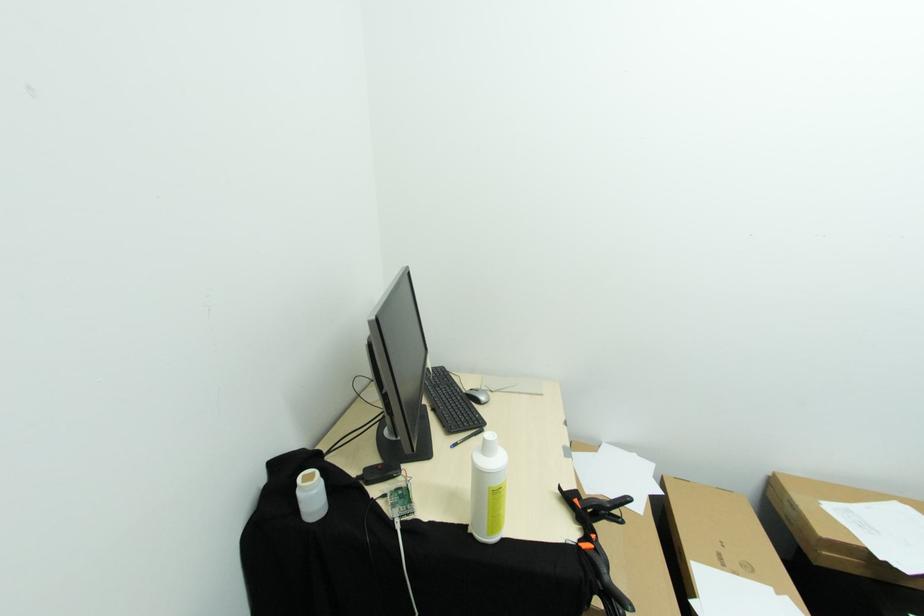
Where would you turn the tan bottle cap? Please return your answer as a coordinate pair (x, y).

(310, 495)